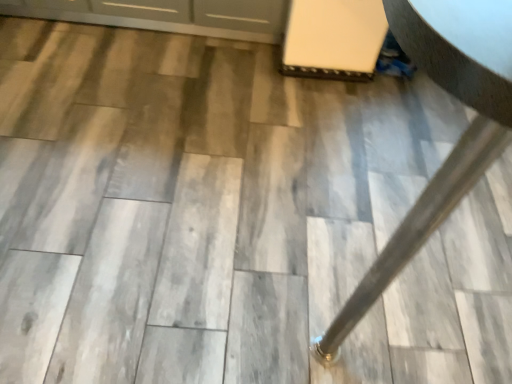
You are a GUI agent. You are given a task and a screenshot of the screen. Output one action in this format:
    pyautogui.click(x=<x>, y=<y>)
    Task: Click on the free space that is to the left of metallic pole at lower right
    
    Given the screenshot: What is the action you would take?
    pyautogui.click(x=145, y=173)